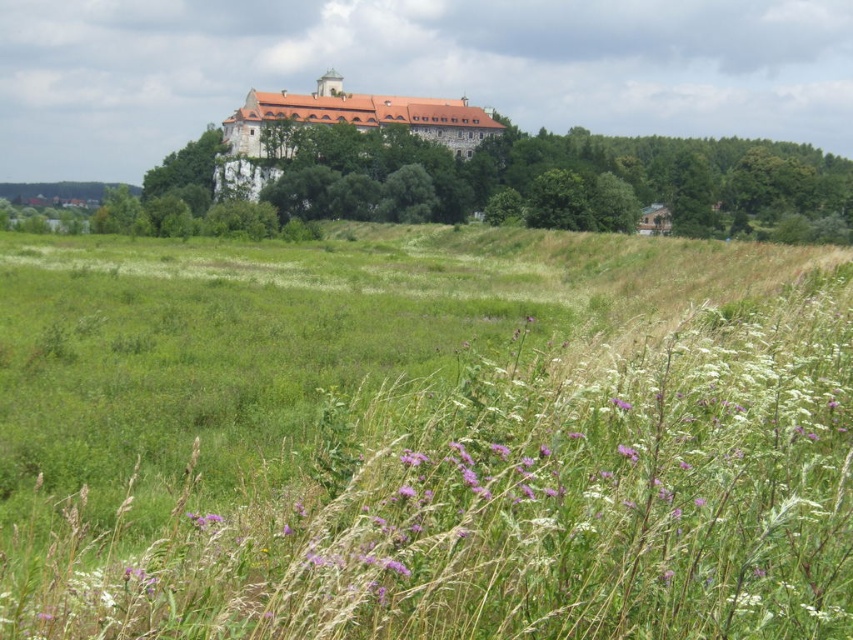
Between brown stone castle at upper center and green leafy tree at upper center, which one is positioned lower?

green leafy tree at upper center is below.

Which is behind, point (265, 157) or point (152, 195)?

Point (152, 195)

The image size is (853, 640). In order to click on brown stone castle at upper center in this screenshot , I will do `click(338, 124)`.

Which is below, brown stone castle at upper center or purple matte flower at center?

purple matte flower at center

Does brown stone castle at upper center have a smaller size compared to purple matte flower at center?

Actually, brown stone castle at upper center might be larger than purple matte flower at center.

This screenshot has height=640, width=853. Find the location of `brown stone castle at upper center`. brown stone castle at upper center is located at coordinates (338, 124).

Can you confirm if green leafy tree at upper center is positioned to the right of purple matte flower at center?

No, green leafy tree at upper center is not to the right of purple matte flower at center.

Does point (204, 145) lie in front of point (611, 403)?

No.

Locate an element on the screen. This screenshot has width=853, height=640. green leafy tree at upper center is located at coordinates (187, 172).